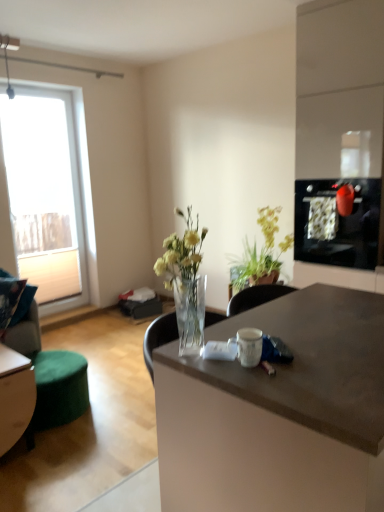
This screenshot has width=384, height=512. Find the location of `vacant space to the right of green fabric ottoman at lower left`. vacant space to the right of green fabric ottoman at lower left is located at coordinates (70, 444).